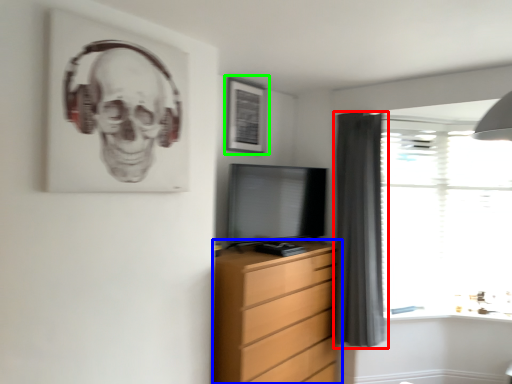
Question: Which is nearer to the curtain (highlighted by a red box)? chest of drawers (highlighted by a blue box) or picture frame (highlighted by a green box).

Choices:
 (A) chest of drawers
 (B) picture frame

Answer: (A)